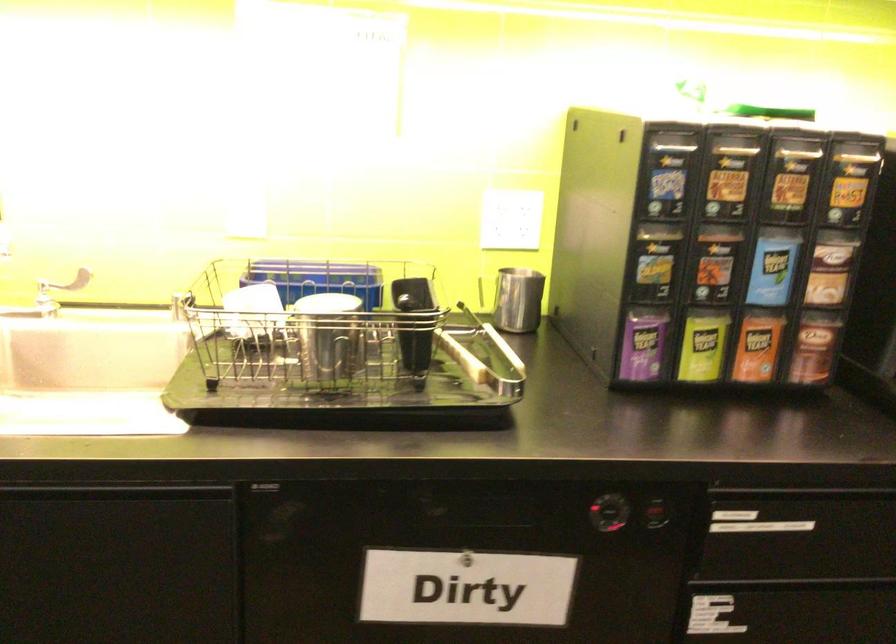
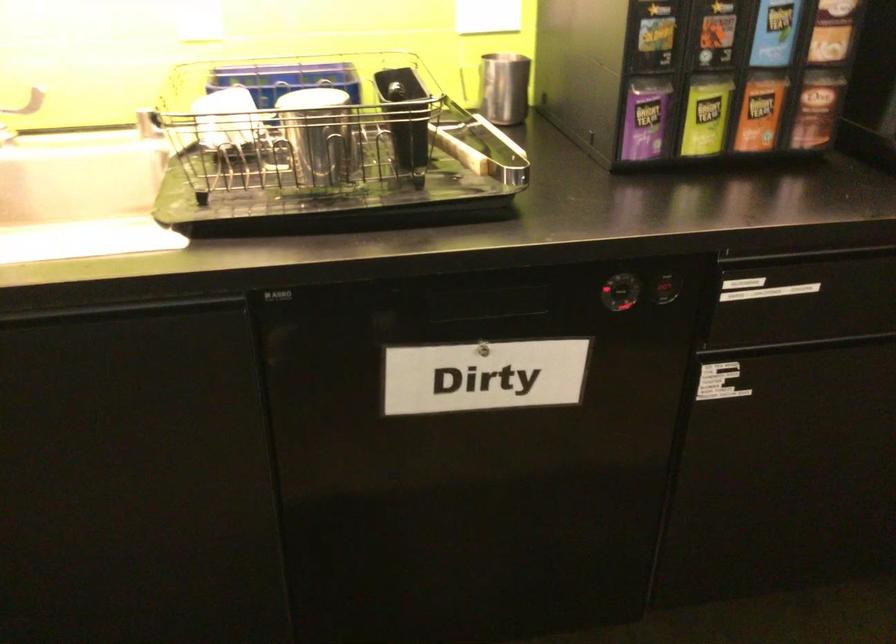
Question: The first image is from the beginning of the video and the second image is from the end. How did the camera likely rotate when shooting the video?

Choices:
 (A) Left
 (B) Right
 (C) Up
 (D) Down

Answer: (D)